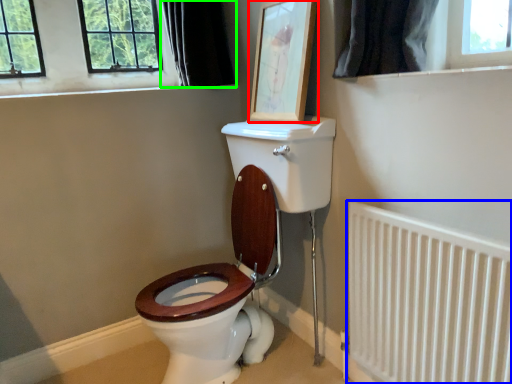
Question: Considering the real-world distances, which object is closest to picture frame (highlighted by a red box)? radiator (highlighted by a blue box) or curtain (highlighted by a green box).

Choices:
 (A) radiator
 (B) curtain

Answer: (B)